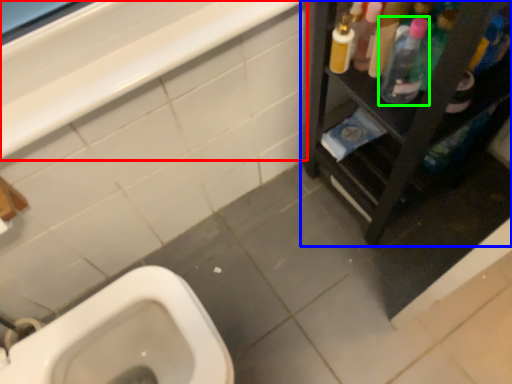
Question: Based on their relative distances, which object is farther from balustrade (highlighted by a red box)? Choose from furniture (highlighted by a blue box) and cleaning product (highlighted by a green box).

Choices:
 (A) furniture
 (B) cleaning product

Answer: (A)